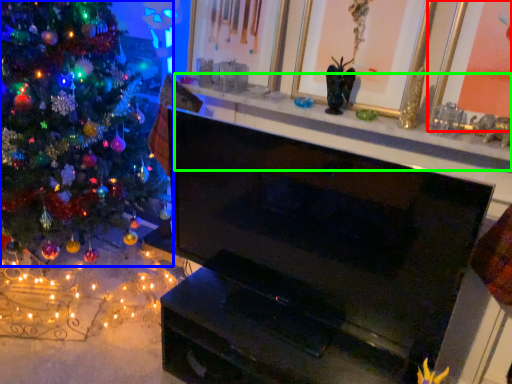
Question: Which is nearer to the picture frame (highlighted by a red box)? christmas tree (highlighted by a blue box) or mantle (highlighted by a green box).

Choices:
 (A) christmas tree
 (B) mantle

Answer: (B)